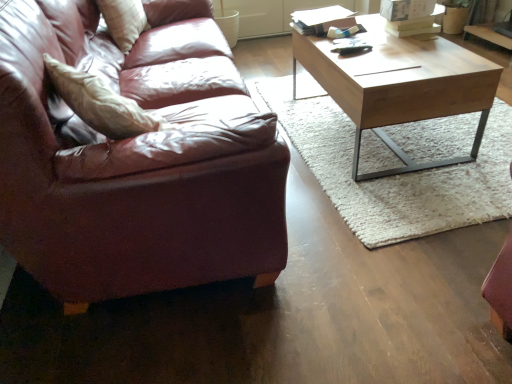
Question: Considering their positions, is plush white pillow at upper left located in front of or behind leather couch at left?

Choices:
 (A) front
 (B) behind

Answer: (B)

Question: From their relative heights in the image, would you say plush white pillow at upper left is taller or shorter than leather couch at left?

Choices:
 (A) short
 (B) tall

Answer: (A)

Question: Estimate the real-world distances between objects in this image. Which object is closer to the light brown wood coffee table at center?

Choices:
 (A) plush white pillow at upper left
 (B) leather couch at left

Answer: (B)

Question: Estimate the real-world distances between objects in this image. Which object is closer to the plush white pillow at upper left?

Choices:
 (A) leather couch at left
 (B) light brown wood coffee table at center

Answer: (A)